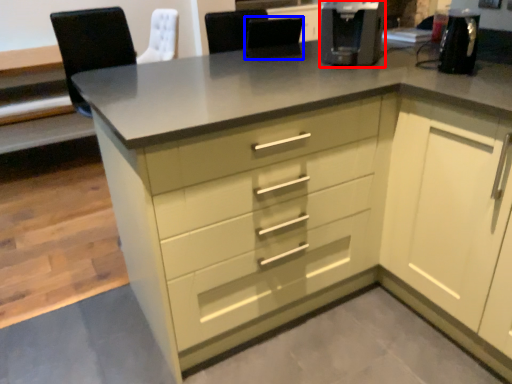
Question: Among these objects, which one is farthest to the camera, coffee machine (highlighted by a red box) or chair (highlighted by a blue box)?

Choices:
 (A) coffee machine
 (B) chair

Answer: (B)